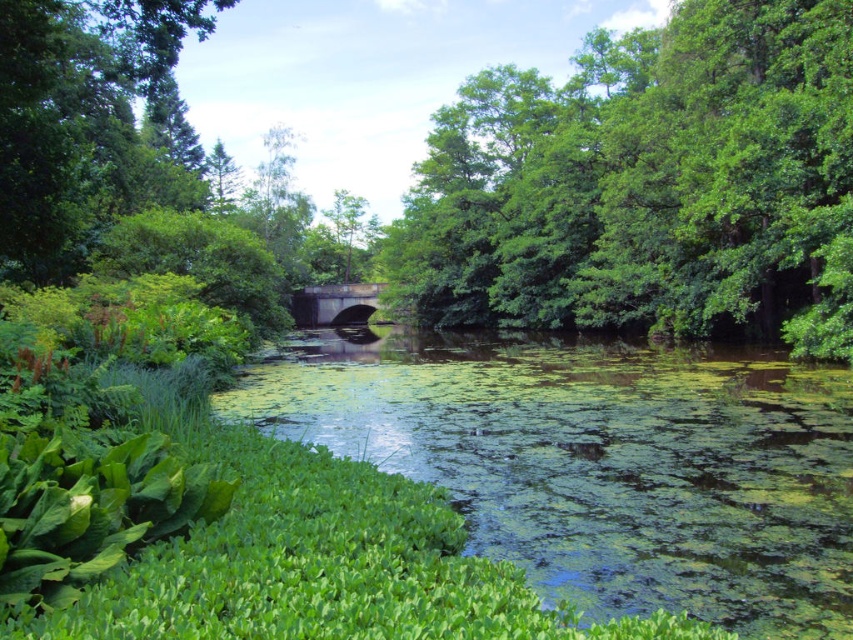
You are standing at the point labeled as point (706,225) and want to walk towards the point labeled as point (793,588). Which direction should you move to get closer to your destination?

To move from point (706,225) towards point (793,588), you should move downward because point (793,588) is closer to the viewer than point (706,225).